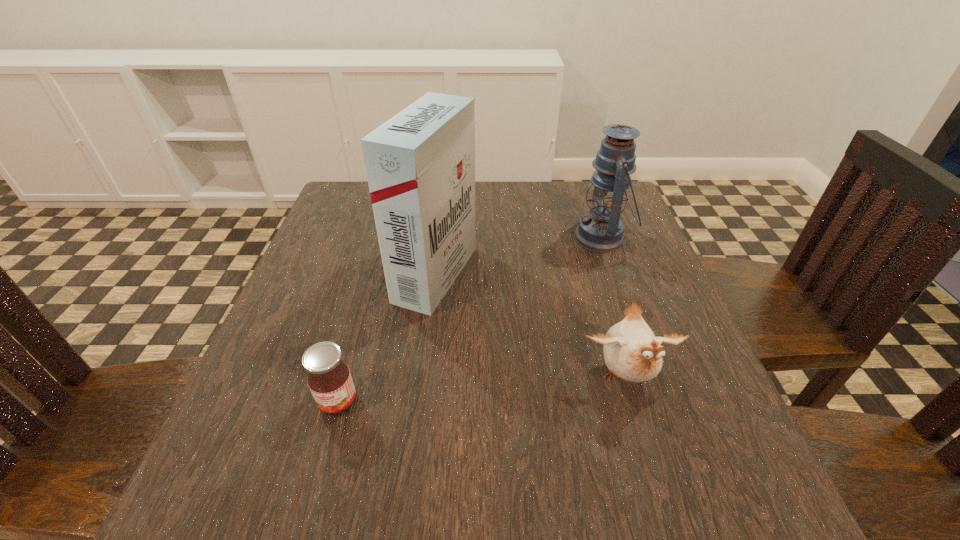
This screenshot has width=960, height=540. Find the location of `free space at the right edge of the desktop`. free space at the right edge of the desktop is located at coordinates (685, 452).

The width and height of the screenshot is (960, 540). What are the coordinates of `free spot at the far left corner of the desktop` in the screenshot? It's located at (347, 211).

Identify the location of vacant area that lies between the shortest object and the cigarette case. (387, 338).

Find the location of a particular element. unoccupied area between the lantern and the shortest object is located at coordinates (469, 320).

At what (x,y) coordinates should I click in order to perform the action: click on free space that is in between the jam and the second object from left to right. Please return your answer as a coordinate pair (x, y). This screenshot has height=540, width=960. Looking at the image, I should click on (387, 338).

Where is `vacant space that's between the bird and the lantern`? Image resolution: width=960 pixels, height=540 pixels. vacant space that's between the bird and the lantern is located at coordinates (613, 308).

This screenshot has width=960, height=540. I want to click on empty location between the second object from left to right and the leftmost object, so click(387, 338).

I want to click on blank region between the jam and the bird, so click(482, 390).

Find the location of `free space between the second tallest object and the tallest object`. free space between the second tallest object and the tallest object is located at coordinates (518, 256).

You are a GUI agent. You are given a task and a screenshot of the screen. Output one action in this format:
    pyautogui.click(x=<x>, y=<y>)
    Task: Click on the free space between the third object from right to left and the shortest object
    
    Given the screenshot: What is the action you would take?
    pyautogui.click(x=387, y=338)